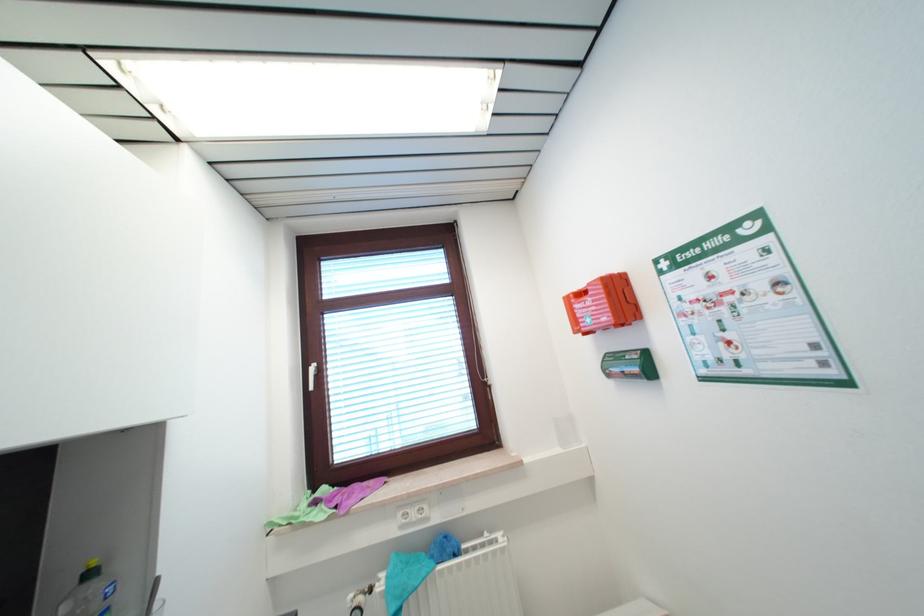
What do you see at coordinates (471, 314) in the screenshot?
I see `a white blinds cord` at bounding box center [471, 314].